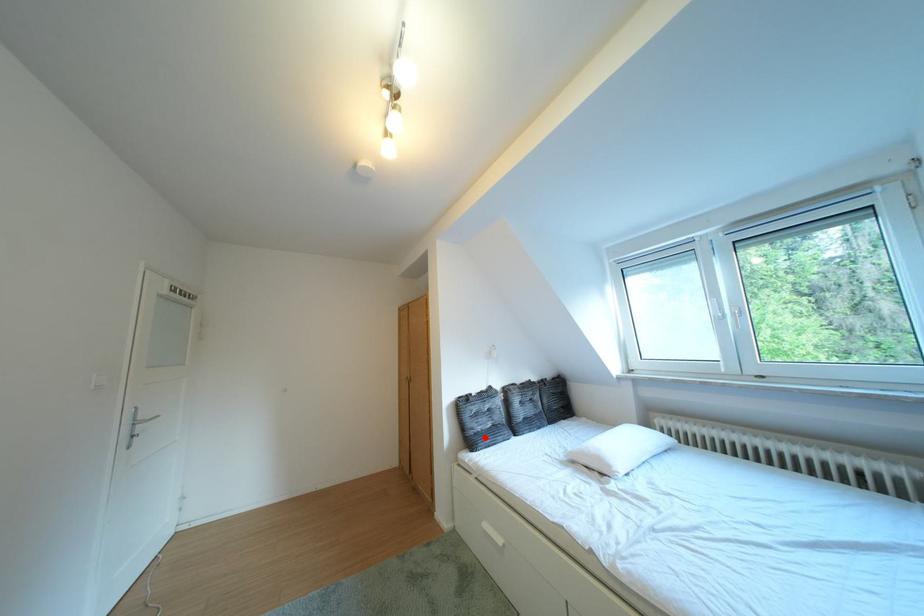
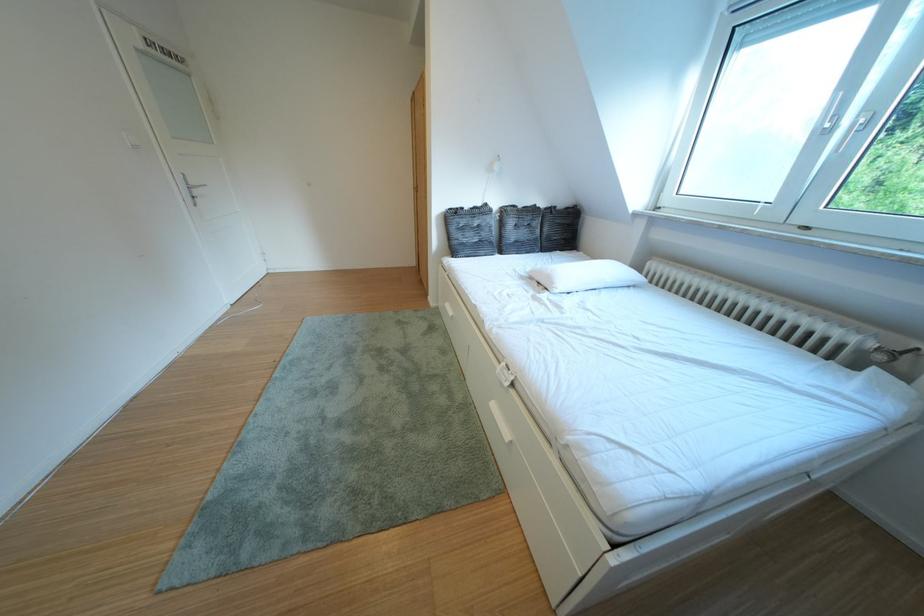
In the second image, find the point that corresponds to the highlighted location in the first image.

(468, 246)